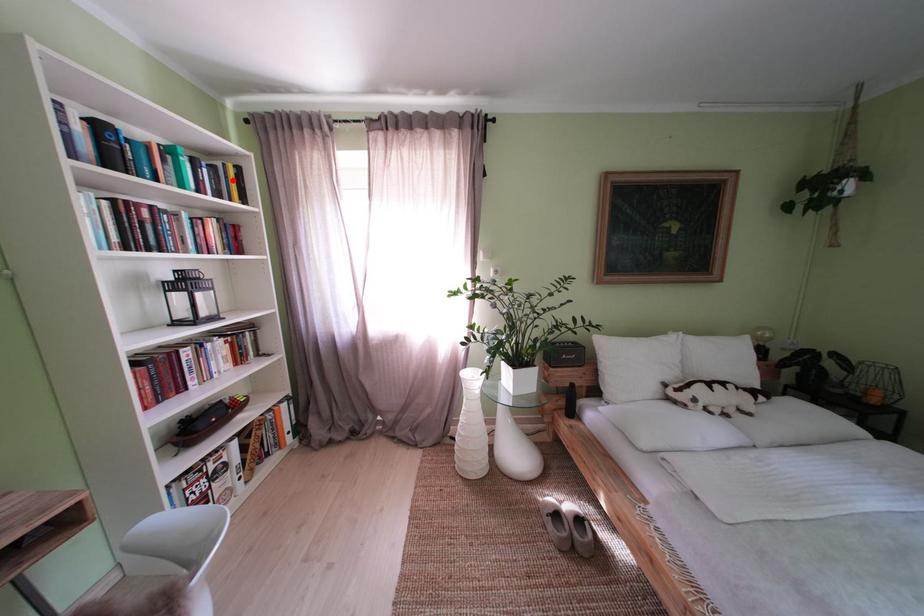
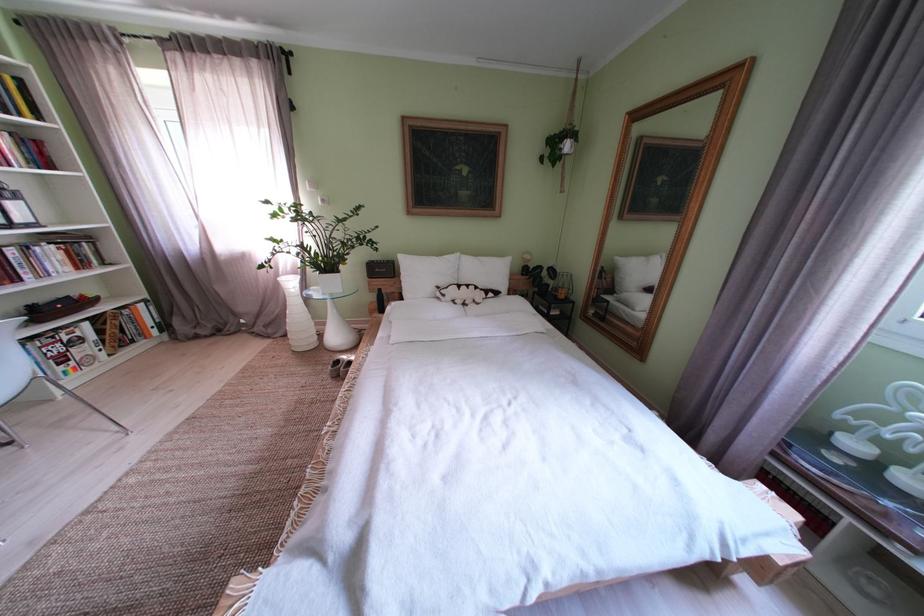
Where in the second image is the point corresponding to the highlighted location from the first image?

(9, 92)